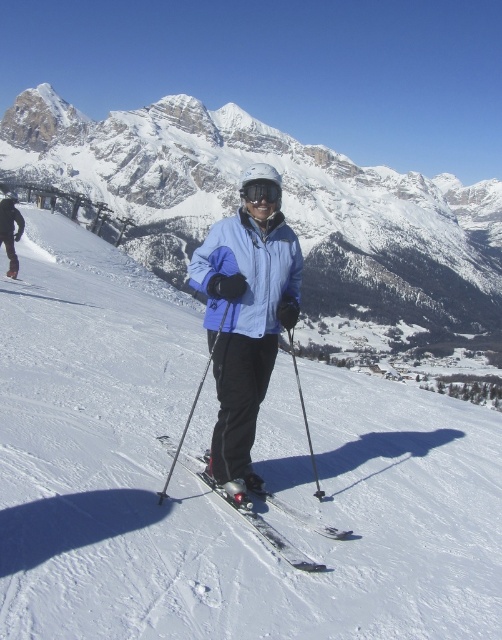
At what (x,y) coordinates should I click in order to perform the action: click on white snow ski slope at center. Please return your answer as a coordinate pair (x, y). The width and height of the screenshot is (502, 640). Looking at the image, I should click on (206, 488).

Is white snow ski slope at center thinner than black matte jacket at center?

No, white snow ski slope at center is not thinner than black matte jacket at center.

What do you see at coordinates (206, 488) in the screenshot? I see `white snow ski slope at center` at bounding box center [206, 488].

Where is `white snow ski slope at center`? Image resolution: width=502 pixels, height=640 pixels. white snow ski slope at center is located at coordinates (206, 488).

Is point (202, 464) less distant than point (12, 195)?

Yes, point (202, 464) is closer to viewer.

Between point (270, 538) and point (10, 218), which one is positioned in front?

Positioned in front is point (270, 538).

Find the location of a particular element. metallic silver skis at center is located at coordinates (251, 516).

Is snowy granite mountain at upper center above black matte jacket at center?

Yes, snowy granite mountain at upper center is above black matte jacket at center.

Does point (435, 225) come farther from viewer compared to point (22, 228)?

Yes, it is behind point (22, 228).

The image size is (502, 640). I want to click on snowy granite mountain at upper center, so click(x=284, y=204).